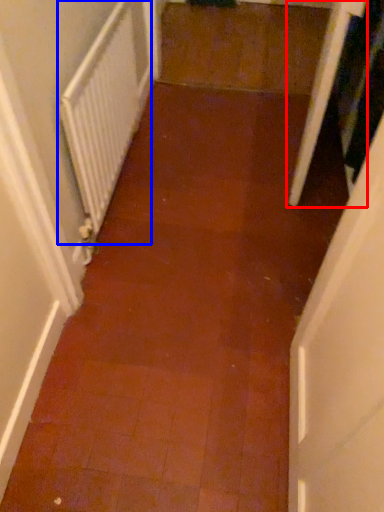
Question: Which object is further to the camera taking this photo, screen door (highlighted by a red box) or radiator (highlighted by a blue box)?

Choices:
 (A) screen door
 (B) radiator

Answer: (A)